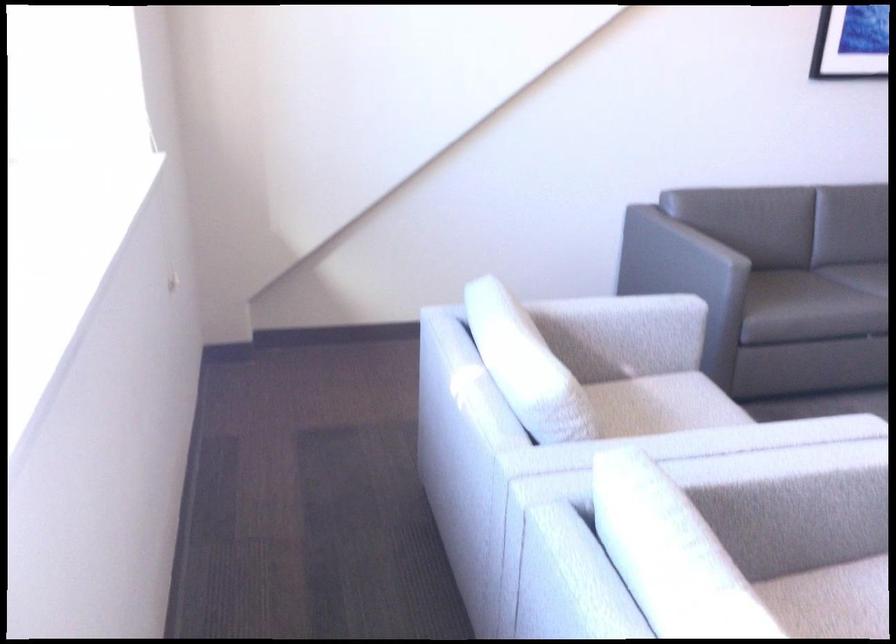
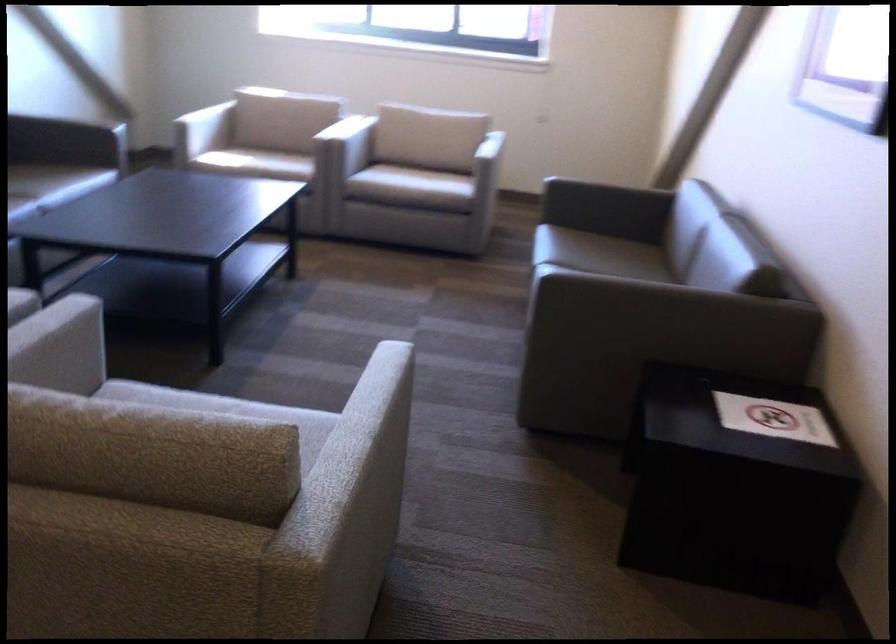
In the second image, find the point that corresponds to (x=745, y=516) in the first image.

(347, 145)